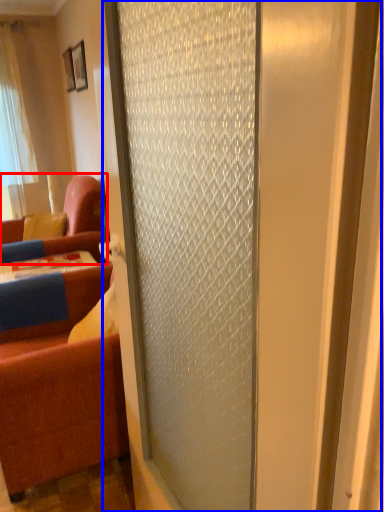
Question: Which object appears farthest to the camera in this image, studio couch (highlighted by a red box) or door (highlighted by a blue box)?

Choices:
 (A) studio couch
 (B) door

Answer: (A)